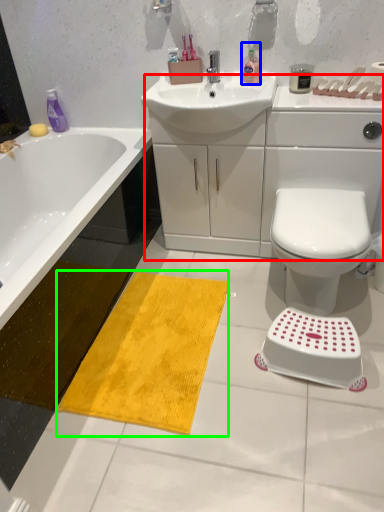
Question: Which object is the farthest from counter top (highlighted by a red box)? Choose among these: cleaning product (highlighted by a blue box) or beach towel (highlighted by a green box).

Choices:
 (A) cleaning product
 (B) beach towel

Answer: (B)